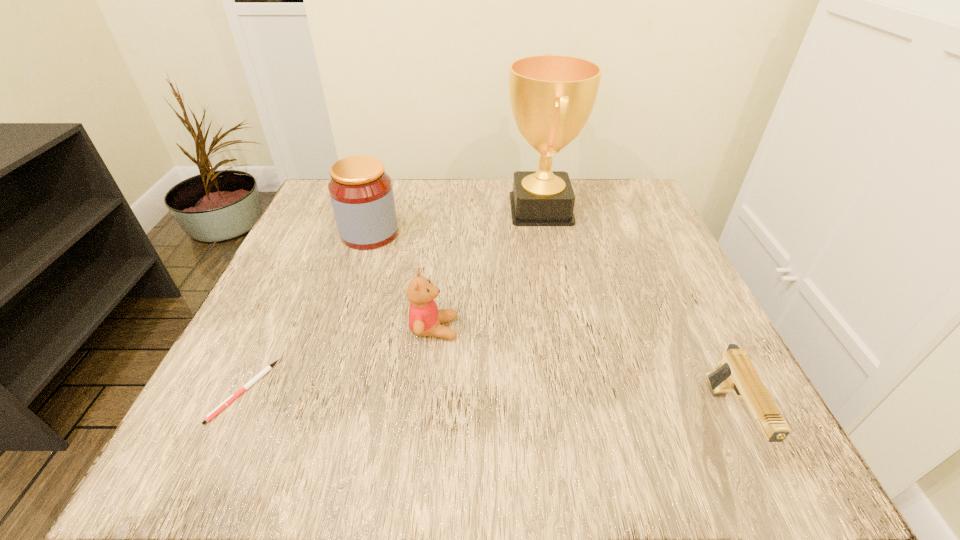
Locate an element on the screen. pen present at the left edge is located at coordinates (230, 399).

Where is `object that is at the right edge`? object that is at the right edge is located at coordinates (736, 373).

You are a GUI agent. You are given a task and a screenshot of the screen. Output one action in this format:
    pyautogui.click(x=<x>, y=<y>)
    Task: Click on the object that is at the far left corner
    
    Given the screenshot: What is the action you would take?
    pyautogui.click(x=361, y=193)

Find the location of a particular element. Image resolution: width=960 pixels, height=540 pixels. object positioned at the near left corner is located at coordinates (230, 399).

Find the location of `object situated at the near right corner`. object situated at the near right corner is located at coordinates (736, 373).

In the image, there is a desktop. Where is `vacant area at the far edge`? vacant area at the far edge is located at coordinates (412, 178).

This screenshot has height=540, width=960. In the image, there is a desktop. Identify the location of vacant space at the near edge. (451, 462).

You are a GUI agent. You are given a task and a screenshot of the screen. Output one action in this format:
    pyautogui.click(x=<x>, y=<y>)
    Task: Click on the vacant space at the left edge
    The width and height of the screenshot is (960, 540).
    Given the screenshot: What is the action you would take?
    pyautogui.click(x=247, y=392)

Image resolution: width=960 pixels, height=540 pixels. I want to click on free space at the right edge of the desktop, so click(x=690, y=387).

The height and width of the screenshot is (540, 960). Find the location of `free space at the near left corner`. free space at the near left corner is located at coordinates (289, 411).